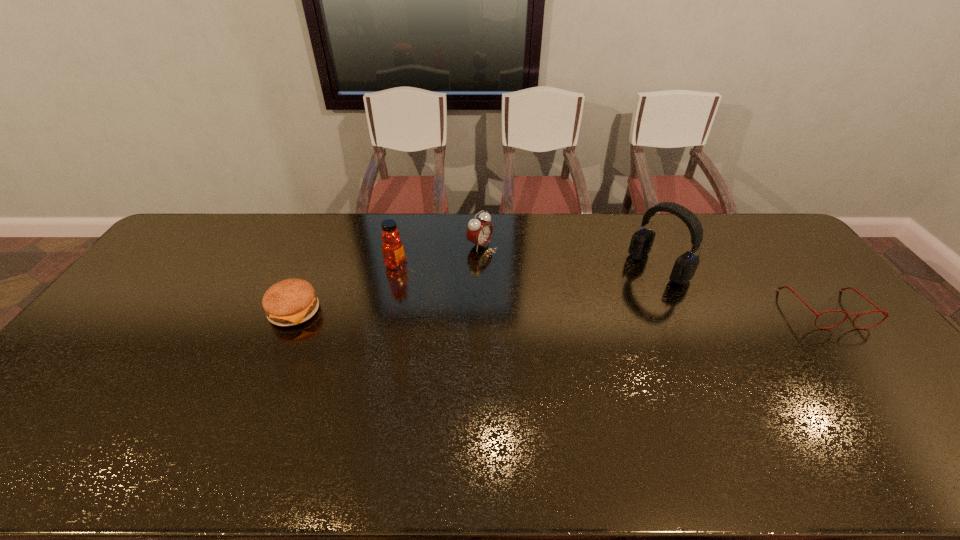
Find the location of `vacant spot on the desktop that is between the hamburger and the rightmost object and is positioned on the headband of the headset`. vacant spot on the desktop that is between the hamburger and the rightmost object and is positioned on the headband of the headset is located at coordinates (595, 309).

At what (x,y) coordinates should I click in order to perform the action: click on free spot on the desktop that is between the hamburger and the spectacles and is positioned on the front label of the honey. Please return your answer as a coordinate pair (x, y). Looking at the image, I should click on (489, 310).

Where is `vacant space on the desktop that is between the leftmost object and the shortest object and is positioned on the clock face of the third object from right to left`? vacant space on the desktop that is between the leftmost object and the shortest object and is positioned on the clock face of the third object from right to left is located at coordinates (600, 309).